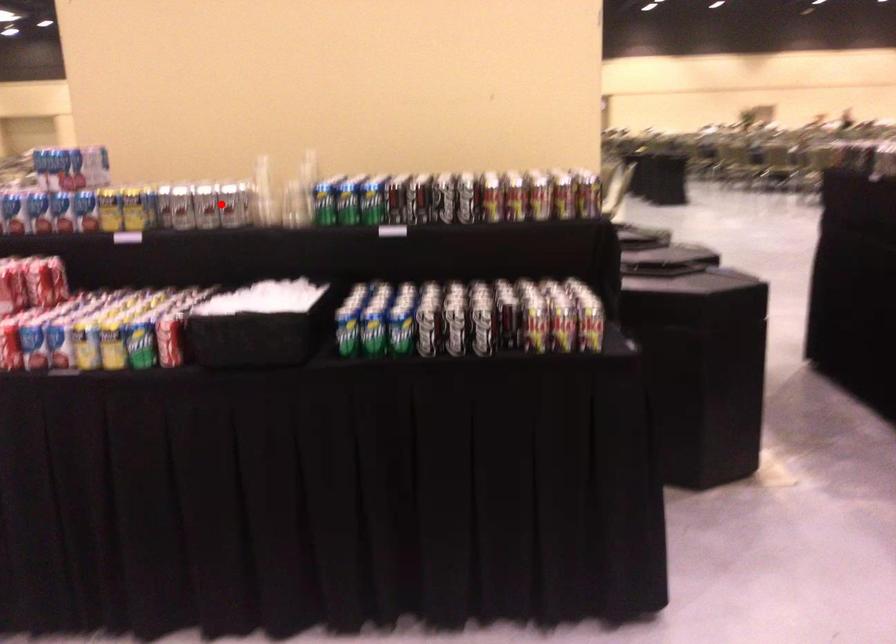
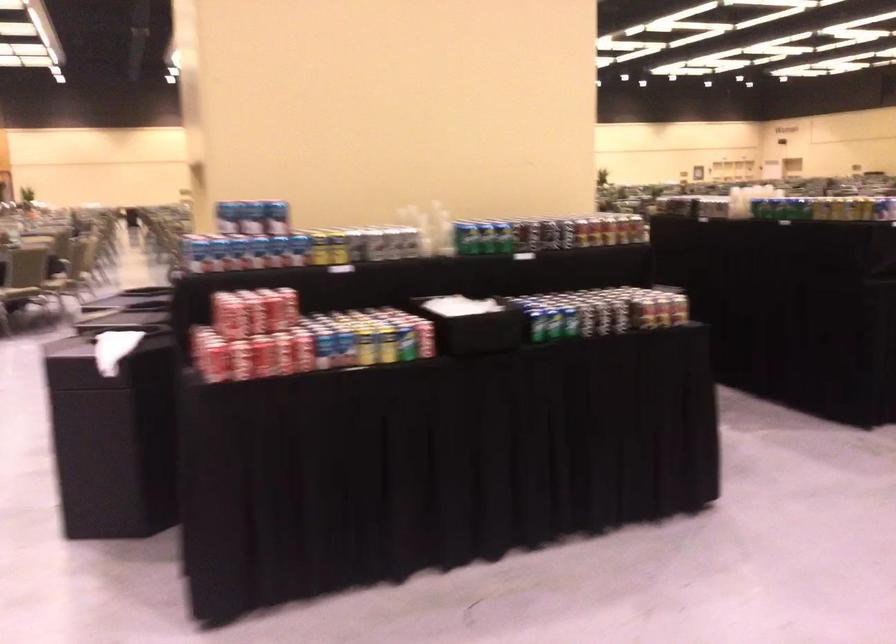
Question: A red point is marked in image1. In image2, is the corresponding 3D point closer to the camera or farther? Reply with the corresponding letter.

Choices:
 (A) The corresponding 3D point is closer.
 (B) The corresponding 3D point is farther.

Answer: (B)